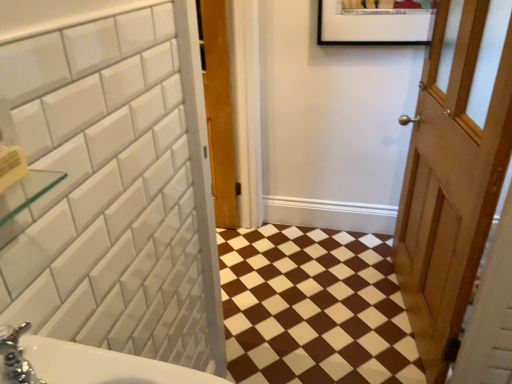
Question: Is wooden door at right shorter than brown glossy tile at center?

Choices:
 (A) no
 (B) yes

Answer: (A)

Question: Is wooden door at right positioned beyond the bounds of brown glossy tile at center?

Choices:
 (A) yes
 (B) no

Answer: (A)

Question: Is wooden door at right positioned with its back to brown glossy tile at center?

Choices:
 (A) yes
 (B) no

Answer: (B)

Question: From a real-world perspective, is wooden door at right physically below brown glossy tile at center?

Choices:
 (A) no
 (B) yes

Answer: (A)

Question: Considering the relative sizes of wooden door at right and brown glossy tile at center in the image provided, is wooden door at right bigger than brown glossy tile at center?

Choices:
 (A) yes
 (B) no

Answer: (A)

Question: Is wooden door at right further to the viewer compared to brown glossy tile at center?

Choices:
 (A) no
 (B) yes

Answer: (A)

Question: Can you confirm if brown glossy tile at center is smaller than wooden door at right?

Choices:
 (A) no
 (B) yes

Answer: (B)

Question: Is brown glossy tile at center surrounding wooden door at right?

Choices:
 (A) yes
 (B) no

Answer: (B)

Question: Does brown glossy tile at center have a greater height compared to wooden door at right?

Choices:
 (A) yes
 (B) no

Answer: (B)

Question: Considering the relative sizes of brown glossy tile at center and wooden door at right in the image provided, is brown glossy tile at center wider than wooden door at right?

Choices:
 (A) no
 (B) yes

Answer: (B)

Question: Would you say brown glossy tile at center is outside wooden door at right?

Choices:
 (A) no
 (B) yes

Answer: (B)

Question: Does brown glossy tile at center appear on the right side of wooden door at right?

Choices:
 (A) yes
 (B) no

Answer: (B)

Question: From a real-world perspective, is brown glossy tile at center above or below wooden door at right?

Choices:
 (A) below
 (B) above

Answer: (A)